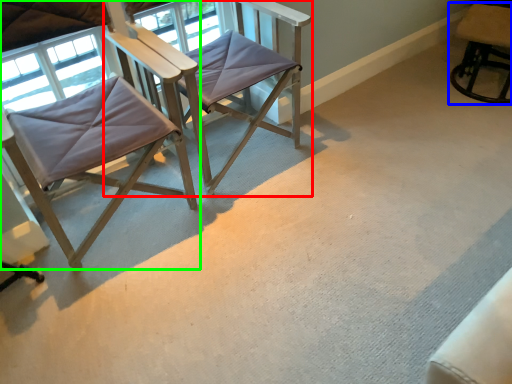
Question: Which is nearer to the chair (highlighted by a red box)? chair (highlighted by a blue box) or chair (highlighted by a green box).

Choices:
 (A) chair
 (B) chair

Answer: (B)